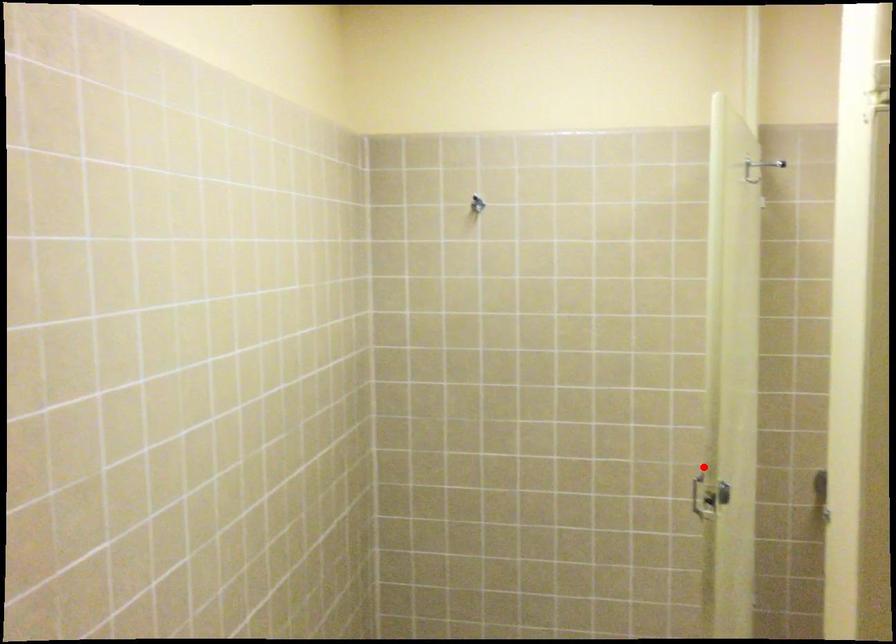
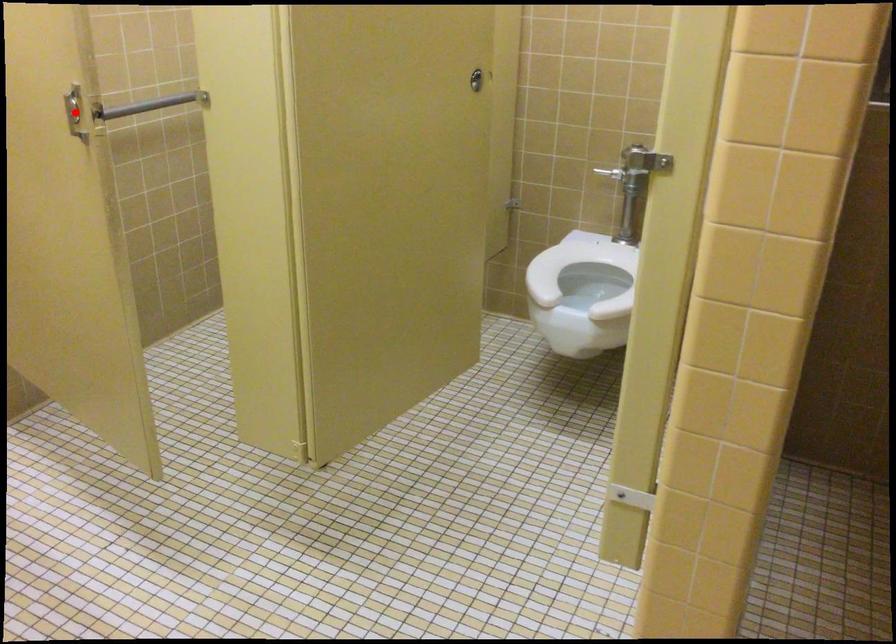
I am providing you with two images of the same scene from different viewpoints. A red point is marked on the first image and another point is marked on the second image. Do the highlighted points in image1 and image2 indicate the same real-world spot?

Yes